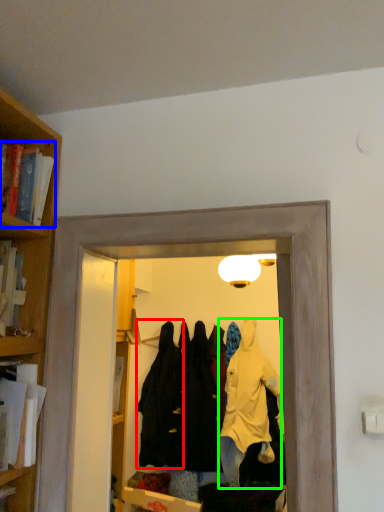
Question: Which object is positioned farthest from clothing (highlighted by a red box)? Select from book (highlighted by a blue box) and clothing (highlighted by a green box).

Choices:
 (A) book
 (B) clothing

Answer: (A)